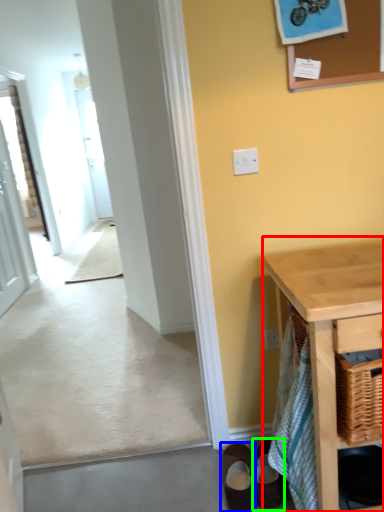
Question: Estimate the real-world distances between objects in this image. Which object is farther from table (highlighted by a red box), footwear (highlighted by a blue box) or footwear (highlighted by a green box)?

Choices:
 (A) footwear
 (B) footwear

Answer: (A)